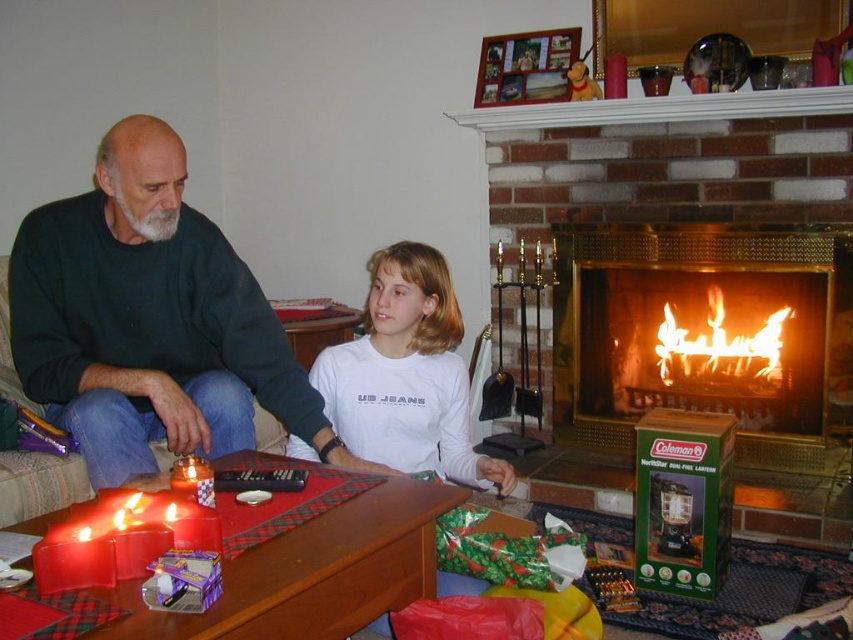
Can you confirm if brass fireplace at center is positioned to the right of matte red candle at lower left?

Indeed, brass fireplace at center is positioned on the right side of matte red candle at lower left.

I want to click on brass fireplace at center, so click(x=689, y=326).

Can you confirm if dark green sweater at left is positioned to the right of brass fireplace at center?

No, dark green sweater at left is not to the right of brass fireplace at center.

Is dark green sweater at left to the left of brass fireplace at center from the viewer's perspective?

Indeed, dark green sweater at left is positioned on the left side of brass fireplace at center.

You are a GUI agent. You are given a task and a screenshot of the screen. Output one action in this format:
    pyautogui.click(x=<x>, y=<y>)
    Task: Click on the dark green sweater at left
    
    Given the screenshot: What is the action you would take?
    pyautogui.click(x=149, y=321)

Locate an element on the screen. This screenshot has width=853, height=640. dark green sweater at left is located at coordinates (149, 321).

What do you see at coordinates (407, 374) in the screenshot?
I see `white matte shirt at center` at bounding box center [407, 374].

Consider the image. Does white matte shirt at center come in front of flamematerial/texture at position?

Yes, it is.

What do you see at coordinates (407, 374) in the screenshot? The height and width of the screenshot is (640, 853). I see `white matte shirt at center` at bounding box center [407, 374].

Find the location of `white matte shirt at center`. white matte shirt at center is located at coordinates [x=407, y=374].